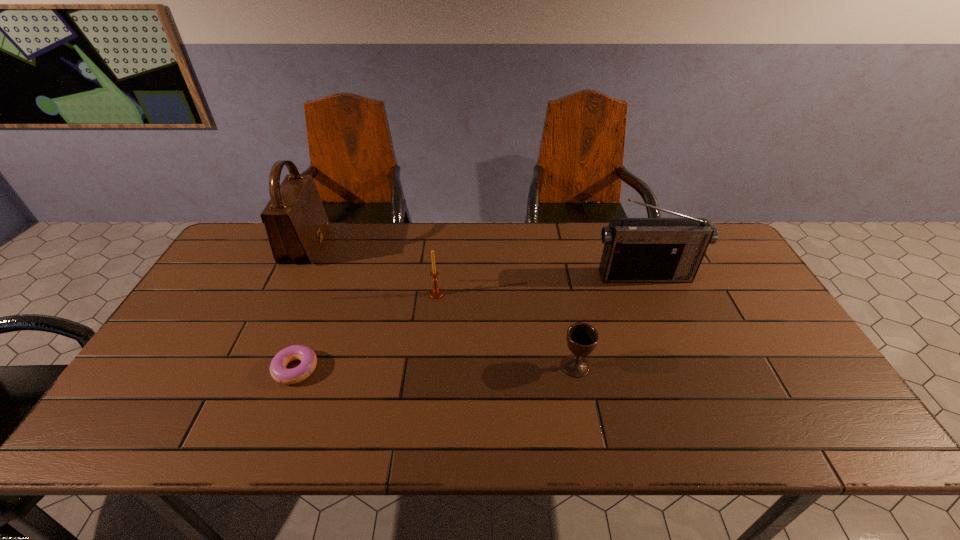
Where is `vacant space positioned on the left of the third shortest object`? The width and height of the screenshot is (960, 540). vacant space positioned on the left of the third shortest object is located at coordinates (354, 294).

You are a GUI agent. You are given a task and a screenshot of the screen. Output one action in this format:
    pyautogui.click(x=<x>, y=<y>)
    Task: Click on the free space located on the front of the chalice
    
    Given the screenshot: What is the action you would take?
    pyautogui.click(x=586, y=415)

What are the coordinates of `blank area located on the left of the doughnut` in the screenshot? It's located at (226, 369).

You are a GUI agent. You are given a task and a screenshot of the screen. Output one action in this format:
    pyautogui.click(x=<x>, y=<y>)
    Task: Click on the shoulder bag positioned at the far edge
    The image size is (960, 540).
    Given the screenshot: What is the action you would take?
    pyautogui.click(x=296, y=223)

Locate an element on the screen. This screenshot has width=960, height=540. radio receiver located in the far edge section of the desktop is located at coordinates (636, 250).

Locate an element on the screen. This screenshot has width=960, height=540. object at the right edge is located at coordinates (636, 250).

Image resolution: width=960 pixels, height=540 pixels. Find the location of `object at the far right corner`. object at the far right corner is located at coordinates (636, 250).

Where is `vacant space at the far edge of the desktop`? vacant space at the far edge of the desktop is located at coordinates (473, 230).

You are a GUI agent. You are given a task and a screenshot of the screen. Output one action in this format:
    pyautogui.click(x=<x>, y=<y>)
    Task: Click on the vacant space at the near edge
    The image size is (960, 540).
    Given the screenshot: What is the action you would take?
    pyautogui.click(x=670, y=412)

At what (x,y) coordinates should I click in order to perform the action: click on vacant space at the right edge. Please return your answer as a coordinate pair (x, y). This screenshot has width=960, height=540. Looking at the image, I should click on pyautogui.click(x=746, y=332).